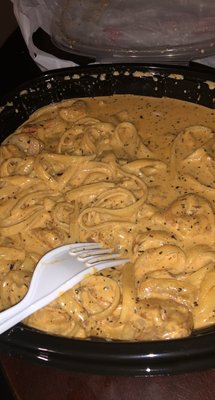
Locate an element on the screen. Image resolution: width=215 pixels, height=400 pixels. surface is located at coordinates (84, 386).